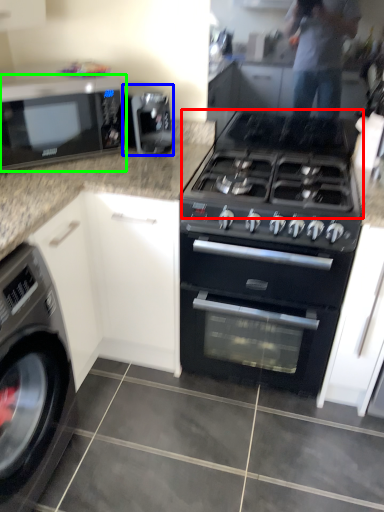
Question: Which object is positioned closest to gas stove (highlighted by a red box)? Select from appliance (highlighted by a blue box) and microwave oven (highlighted by a green box).

Choices:
 (A) appliance
 (B) microwave oven

Answer: (A)